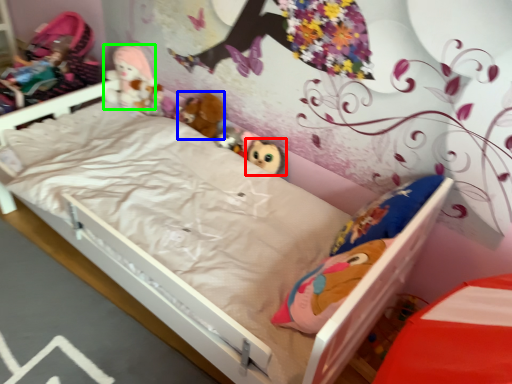
Question: Which is nearer to the toy (highlighted by a red box)? doll (highlighted by a blue box) or doll (highlighted by a green box).

Choices:
 (A) doll
 (B) doll

Answer: (A)